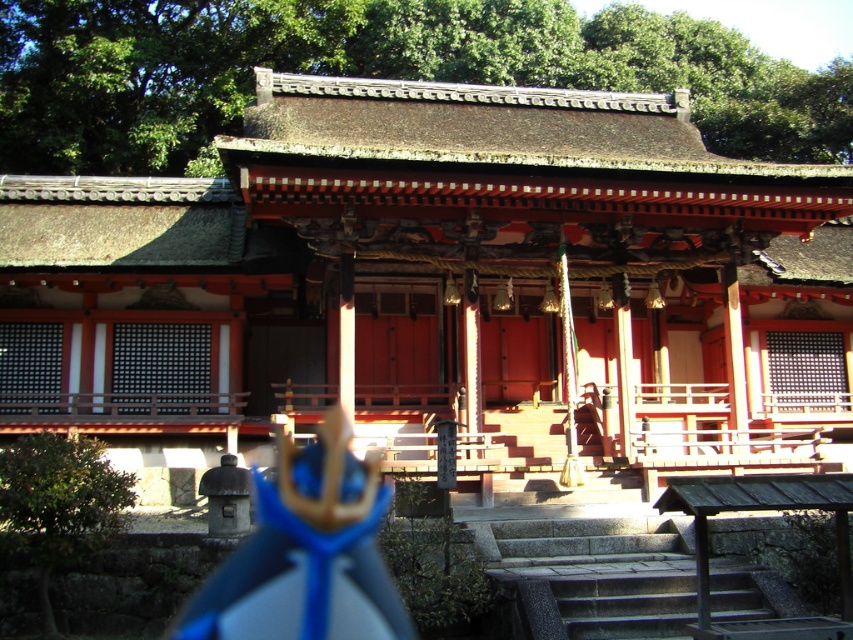
You are standing at the base of the shrine steps and want to take a photo of the matte red shrine at center. If your camera has a maximum zoom range of 10 meters, will you be able to capture the entire shrine in the photo without moving closer?

The matte red shrine at center is 14.07 meters away from the camera, which exceeds the camera maximum zoom range of 10 meters. Therefore, you will not be able to capture the entire shrine in the photo without moving closer.

You are a visitor at the shrine and want to take a photo of the matte red shrine at center from the bottom of the gray stone stairs at center. Considering the height difference between them, will the shrine be fully visible in the photo without any obstruction?

The matte red shrine at center is much taller than the gray stone stairs at center, so the shrine will be fully visible in the photo without any obstruction because its height surpasses the stairs.